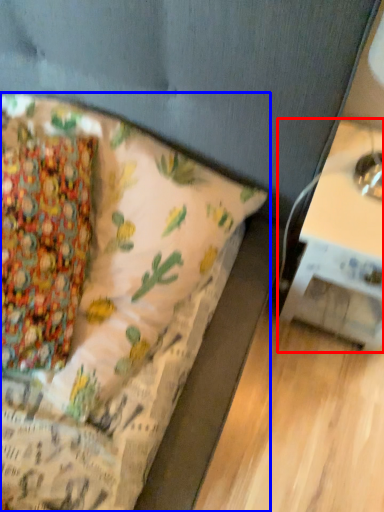
Question: Among these objects, which one is nearest to the camera, table (highlighted by a red box) or bed (highlighted by a blue box)?

Choices:
 (A) table
 (B) bed

Answer: (B)